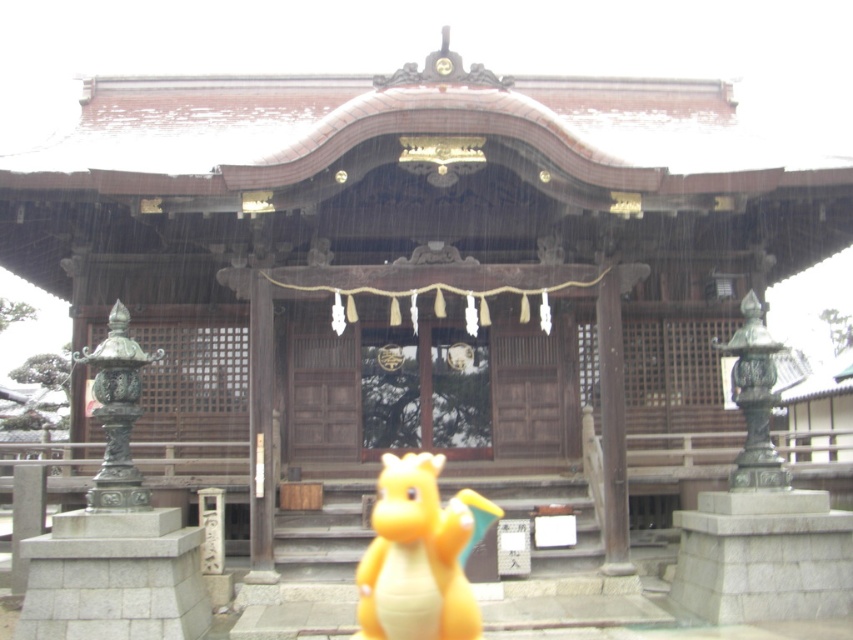
You are a visitor at the shrine and want to take a photo of the yellow matte toy dragon at center and the bronze statue at left. Which object should you focus on first if you want to capture both in the same frame without moving the camera?

You should focus on the yellow matte toy dragon at center first because it is larger in size than the bronze statue at left, so it will occupy more space in the frame and ensure both are visible.

In the scene shown: You are a visitor at the shrine and want to take a photo of the yellow matte toy dragon at center and the bronze statue at left. Which object should you focus on first if you want to capture both in the same frame without moving your camera?

You should focus on the yellow matte toy dragon at center first because it is positioned under the bronze statue at left, so adjusting the camera to include the lower dragon will naturally include the statue above it in the frame.

You are a visitor at the shrine and want to take a photo of the bronze statue at left without the yellow matte toy dragon at center blocking the view. Is this possible?

The yellow matte toy dragon at center is in front of the bronze statue at left, so the dragon would block the view of the bronze statue at left. To take a photo without the dragon, you would need to move it or position yourself so the dragon is out of the frame.